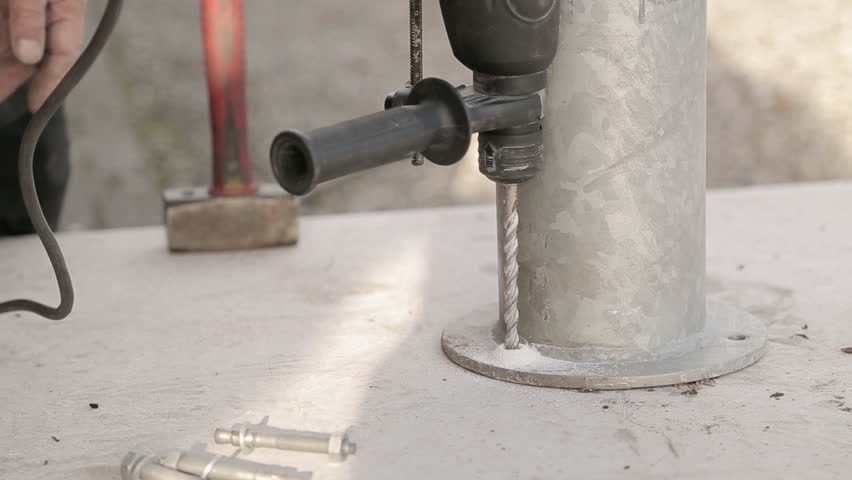
The image size is (852, 480). Identify the location of screws. (285, 444), (232, 471), (162, 469).